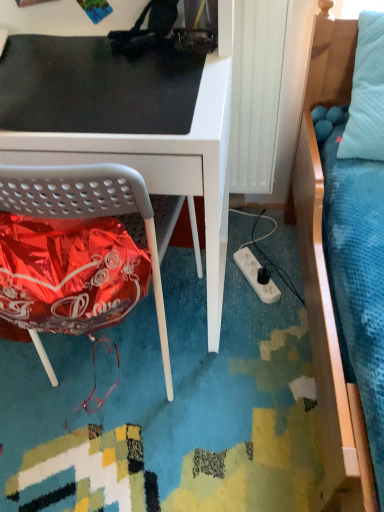
Identify the location of vacant area that lies in front of white plastic power outlet at lower center. (259, 321).